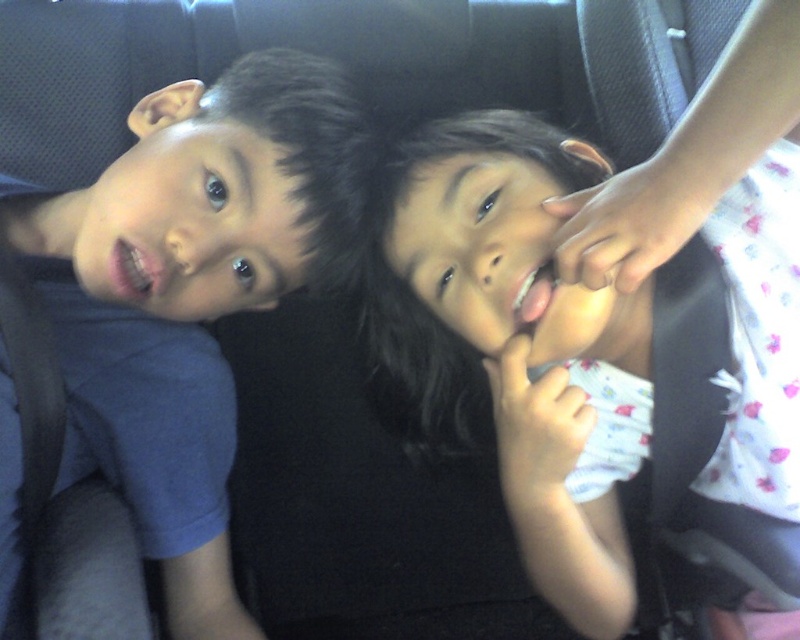
Question: Which of the following is the farthest from the observer?

Choices:
 (A) white fabric hand at upper right
 (B) blue matte shirt at left

Answer: (B)

Question: Is white floral dress at center wider than white fabric hand at upper right?

Choices:
 (A) no
 (B) yes

Answer: (B)

Question: Which object appears farthest from the camera in this image?

Choices:
 (A) blue matte shirt at left
 (B) white fabric hand at upper right
 (C) white floral dress at center

Answer: (A)

Question: From the image, what is the correct spatial relationship of white floral dress at center in relation to blue matte shirt at left?

Choices:
 (A) below
 (B) above

Answer: (A)

Question: Considering the real-world distances, which object is closest to the blue matte shirt at left?

Choices:
 (A) white fabric hand at upper right
 (B) white floral dress at center

Answer: (B)

Question: Does blue matte shirt at left lie in front of white fabric hand at upper right?

Choices:
 (A) no
 (B) yes

Answer: (A)